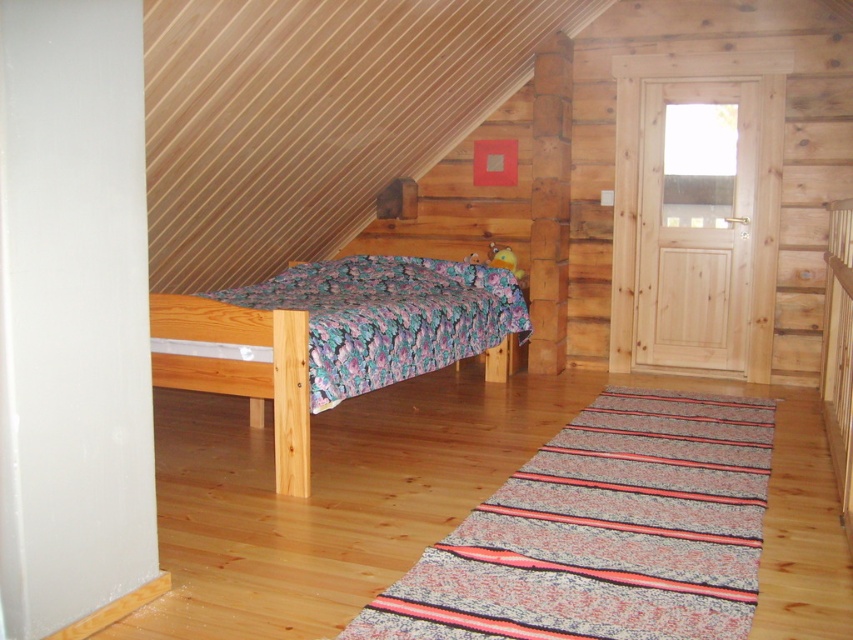
Question: Among these objects, which one is nearest to the camera?

Choices:
 (A) wooden bed at center
 (B) floral fabric quilt at center

Answer: (B)

Question: Is floral fabric quilt at center behind wooden bed at center?

Choices:
 (A) no
 (B) yes

Answer: (A)

Question: Is floral fabric quilt at center thinner than wooden bed at center?

Choices:
 (A) no
 (B) yes

Answer: (A)

Question: Can you confirm if floral fabric quilt at center is smaller than wooden bed at center?

Choices:
 (A) yes
 (B) no

Answer: (A)

Question: Which point is farther to the camera?

Choices:
 (A) (662, 468)
 (B) (463, 310)

Answer: (B)